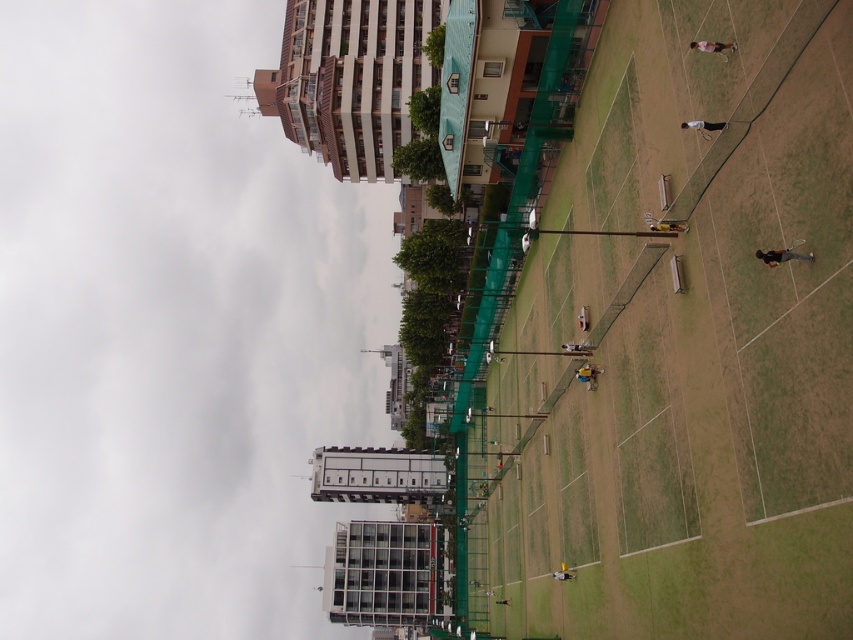
From the picture: You are a photographer trying to capture a closeup of the light brown leather jacket at upper right and the white fabric shirt at lower center. Which object should you zoom in on to make them appear the same size in your photo?

To make the light brown leather jacket at upper right and the white fabric shirt at lower center appear the same size in the photo, you should zoom in on the light brown leather jacket at upper right because it is smaller than the white fabric shirt at lower center.

You are a tennis ball that just flew from the white matte tennis racket at upper right and is heading towards the white fabric shirt at lower center. If your maximum flight distance is 39 meters, will you reach the target?

The distance between the white matte tennis racket at upper right and the white fabric shirt at lower center is 39.47 meters, which exceeds the tennis ball maximum flight distance of 39 meters. Therefore, the tennis ball will not reach the target.